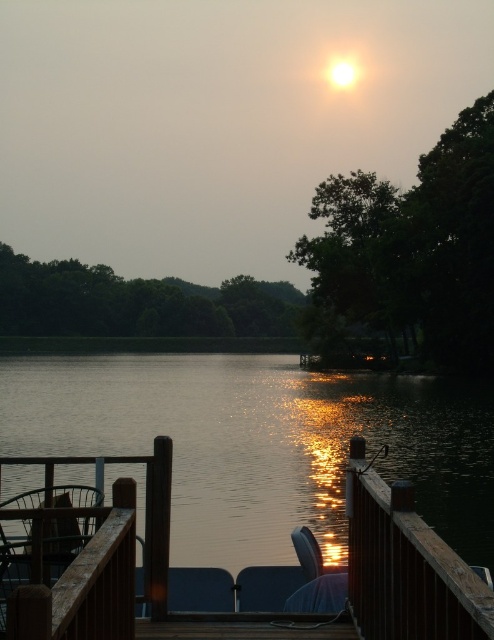
Question: Is the position of brown wooden rail at center less distant than that of matte plastic chair at lower center?

Choices:
 (A) no
 (B) yes

Answer: (B)

Question: Can you confirm if brown wooden rail at center is positioned to the right of matte blue chair at lower center?

Choices:
 (A) yes
 (B) no

Answer: (A)

Question: Which point is farther to the camera?

Choices:
 (A) (475, 385)
 (B) (247, 566)

Answer: (A)

Question: Which object appears closest to the camera in this image?

Choices:
 (A) matte plastic chair at lower center
 (B) matte blue chair at lower center

Answer: (A)

Question: Which point is closer to the camera taking this photo?

Choices:
 (A) (213, 608)
 (B) (266, 604)
 (C) (24, 502)
 (D) (189, 563)

Answer: (C)

Question: Where is glistening water at center located in relation to matte plastic chair at lower center in the image?

Choices:
 (A) left
 (B) right

Answer: (A)